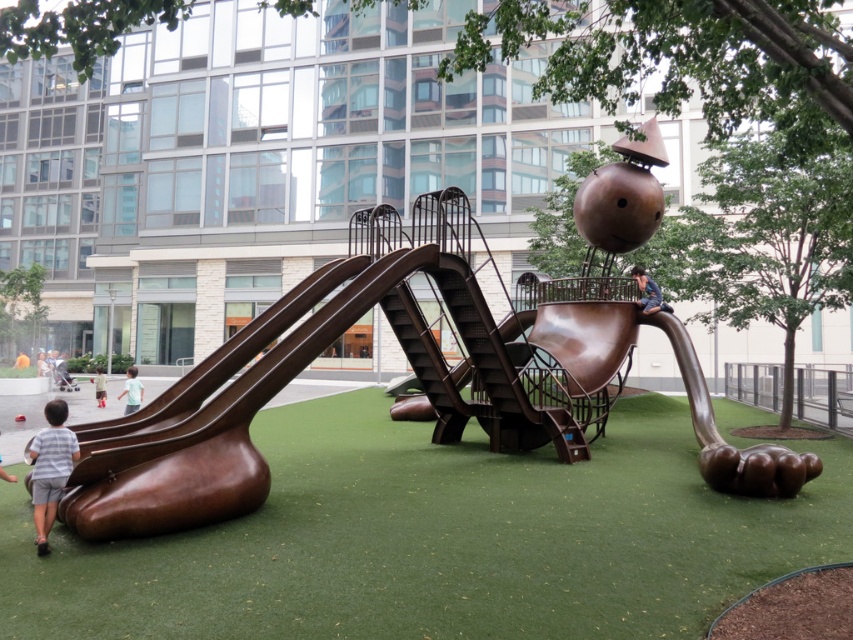
Does point (642, 301) come farther from viewer compared to point (102, 385)?

No, it is in front of (102, 385).

Is bronze statue at center further to camera compared to brown fabric shorts at lower left?

No, bronze statue at center is in front of brown fabric shorts at lower left.

Is point (642, 291) in front of point (96, 387)?

Yes.

You are a GUI agent. You are given a task and a screenshot of the screen. Output one action in this format:
    pyautogui.click(x=<x>, y=<y>)
    Task: Click on the bronze statue at center
    This screenshot has height=640, width=853.
    Given the screenshot: What is the action you would take?
    pyautogui.click(x=647, y=291)

Describe the element at coordinates (421, 364) in the screenshot. I see `bronze sculpture at center` at that location.

Looking at this image, does bronze sculpture at center appear on the left side of bronze smooth slide at lower left?

Incorrect, bronze sculpture at center is not on the left side of bronze smooth slide at lower left.

Between point (601, 196) and point (157, 433), which one is positioned in front?

Point (157, 433)

The height and width of the screenshot is (640, 853). Find the location of `bronze sculpture at center`. bronze sculpture at center is located at coordinates (421, 364).

Is point (538, 500) closer to camera compared to point (115, 504)?

No, (538, 500) is further to viewer.

Does point (616, 460) come in front of point (161, 422)?

No, it is not.

The width and height of the screenshot is (853, 640). Find the location of `green artificial turf at lower center`. green artificial turf at lower center is located at coordinates (437, 540).